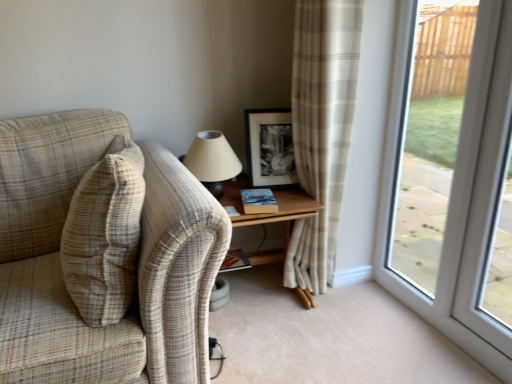
Question: Is wooden table at center wider than plaid fabric couch at left?

Choices:
 (A) no
 (B) yes

Answer: (A)

Question: From the image's perspective, does wooden table at center appear higher than plaid fabric couch at left?

Choices:
 (A) no
 (B) yes

Answer: (A)

Question: Is wooden table at center located outside plaid fabric couch at left?

Choices:
 (A) yes
 (B) no

Answer: (A)

Question: Are wooden table at center and plaid fabric couch at left far apart?

Choices:
 (A) yes
 (B) no

Answer: (B)

Question: Considering the relative sizes of wooden table at center and plaid fabric couch at left in the image provided, is wooden table at center thinner than plaid fabric couch at left?

Choices:
 (A) yes
 (B) no

Answer: (A)

Question: Does wooden table at center turn towards plaid fabric couch at left?

Choices:
 (A) no
 (B) yes

Answer: (A)

Question: Is hardcover book at center, the first book from the bottom, beside matte beige lampshade at upper center?

Choices:
 (A) yes
 (B) no

Answer: (B)

Question: Is hardcover book at center, the 1th book from the back, further to camera compared to matte beige lampshade at upper center?

Choices:
 (A) no
 (B) yes

Answer: (B)

Question: Is matte beige lampshade at upper center located within hardcover book at center, the 1th book from the back?

Choices:
 (A) yes
 (B) no

Answer: (B)

Question: From the image's perspective, is hardcover book at center, placed as the 2th book when sorted from front to back, on matte beige lampshade at upper center?

Choices:
 (A) no
 (B) yes

Answer: (A)

Question: Does hardcover book at center, the first book from the bottom, appear on the right side of matte beige lampshade at upper center?

Choices:
 (A) no
 (B) yes

Answer: (B)

Question: Can you confirm if hardcover book at center, placed as the 2th book when sorted from front to back, is shorter than matte beige lampshade at upper center?

Choices:
 (A) yes
 (B) no

Answer: (A)

Question: Considering the relative positions of black matte picture frame at upper center and matte beige lampshade at upper center in the image provided, is black matte picture frame at upper center to the right of matte beige lampshade at upper center from the viewer's perspective?

Choices:
 (A) no
 (B) yes

Answer: (B)